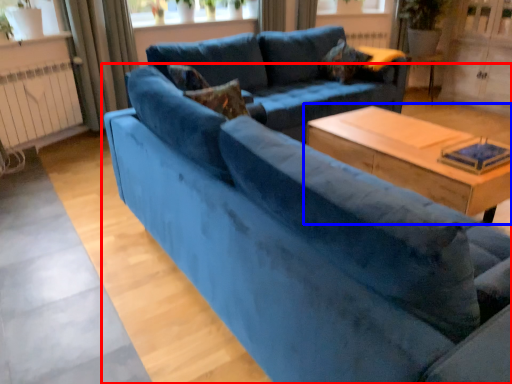
Question: Which of the following is the farthest to the observer, studio couch (highlighted by a red box) or table (highlighted by a blue box)?

Choices:
 (A) studio couch
 (B) table

Answer: (B)